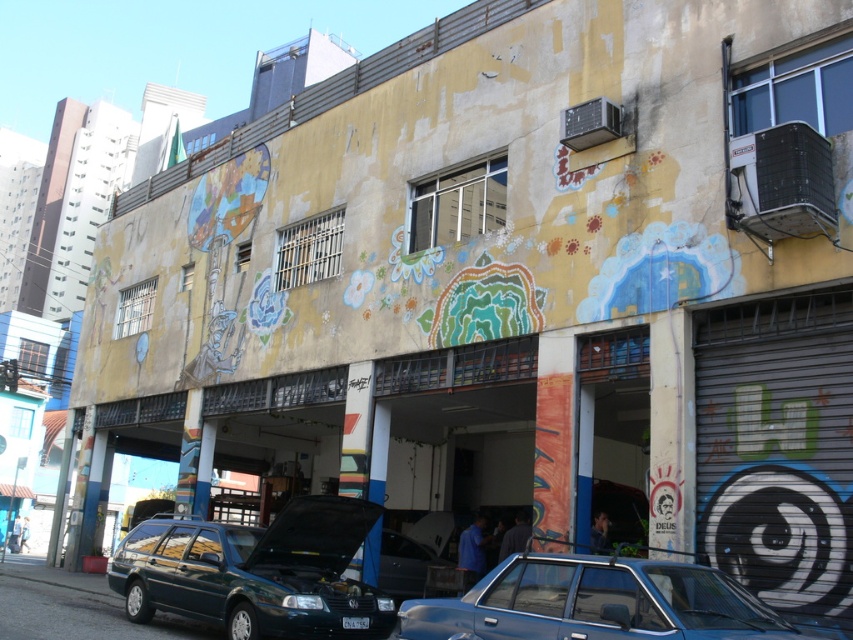
Question: Which of the following is the farthest from the observer?

Choices:
 (A) green matte station wagon at lower center
 (B) metallic blue sedan at lower center

Answer: (A)

Question: Observing the image, what is the correct spatial positioning of metallic blue sedan at lower center in reference to white plastic license plate at center?

Choices:
 (A) above
 (B) below

Answer: (A)

Question: Observing the image, what is the correct spatial positioning of green matte station wagon at lower center in reference to white plastic license plate at center?

Choices:
 (A) right
 (B) left

Answer: (B)

Question: Which point is farther to the camera?

Choices:
 (A) green matte station wagon at lower center
 (B) white plastic license plate at center
 (C) metallic blue sedan at lower center

Answer: (A)

Question: Does metallic blue sedan at lower center come behind white plastic license plate at center?

Choices:
 (A) no
 (B) yes

Answer: (A)

Question: Based on their relative distances, which object is nearer to the metallic blue sedan at lower center?

Choices:
 (A) white plastic license plate at center
 (B) green matte station wagon at lower center

Answer: (A)